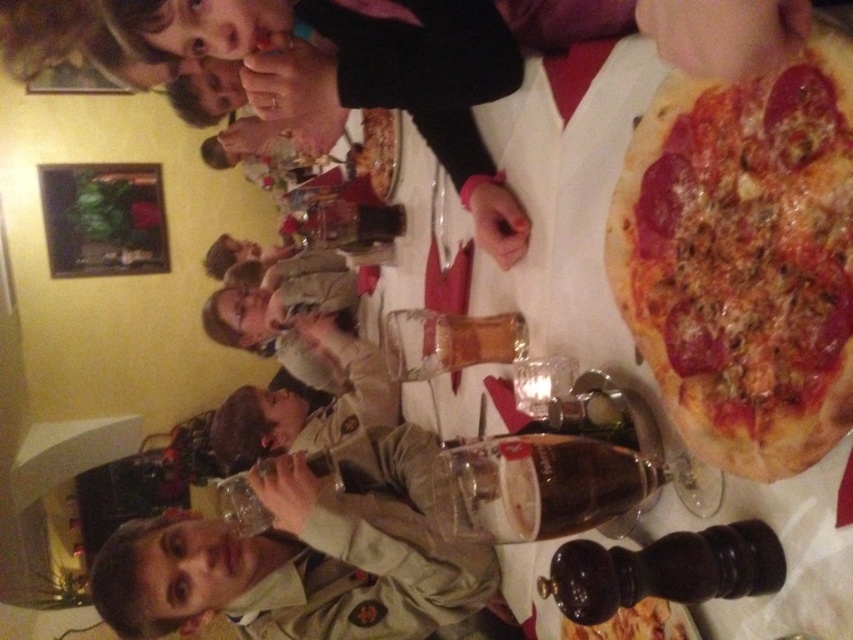
Question: From the image, what is the correct spatial relationship of tan uniform at center in relation to smooth beige shirt at center?

Choices:
 (A) below
 (B) above

Answer: (A)

Question: Which of these objects is positioned closest to the golden crispy pizza at upper right?

Choices:
 (A) smooth black shirt at upper center
 (B) smooth beige shirt at center
 (C) tan uniform at center

Answer: (C)

Question: Does smooth black shirt at upper center have a smaller size compared to clear glass bottle at center?

Choices:
 (A) no
 (B) yes

Answer: (A)

Question: Considering the relative positions of tan uniform at center and black wood pepper mill at lower right in the image provided, where is tan uniform at center located with respect to black wood pepper mill at lower right?

Choices:
 (A) left
 (B) right

Answer: (A)

Question: Based on their relative distances, which object is nearer to the smooth beige shirt at center?

Choices:
 (A) golden crispy pizza at upper right
 (B) black wood pepper mill at lower right
 (C) translucent glass beer at center

Answer: (C)

Question: Among these objects, which one is farthest from the camera?

Choices:
 (A) translucent glass beer at center
 (B) golden crispy pizza at upper right
 (C) golden brown crusty pizza at right

Answer: (A)